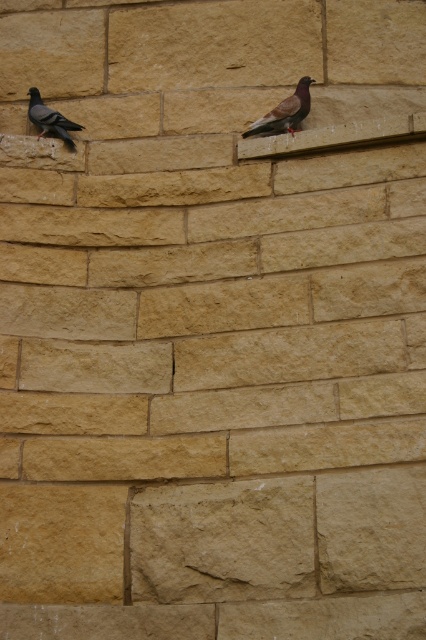
You are a birdwatcher observing a stone wall with two pigeons. The pigeons are the matte gray pigeon at upper center and the matte black pigeon at left. Which pigeon is positioned lower on the wall?

The matte gray pigeon at upper center has a lesser height compared to the matte black pigeon at left, so the matte gray pigeon at upper center is positioned lower on the wall.

You are standing in front of a stone wall and see two pigeons. One is the matte gray pigeon at upper center and the other is the matte black pigeon at left. Which pigeon is closer to you?

The matte gray pigeon at upper center is closer to the viewer than the matte black pigeon at left.

You are standing in front of the stone wall and want to place a small flag at point (284, 115) and another flag at point (36, 113). Which flag will be closer to you?

The flag at point (284, 115) will be closer to you because it is in front of point 0.085, 0.178.